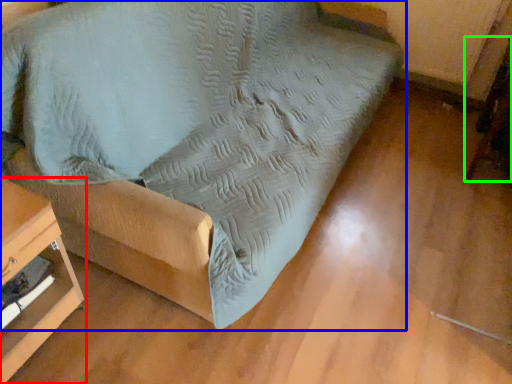
Question: Which object is positioned closest to furniture (highlighted by a red box)? Select from furniture (highlighted by a blue box) and swivel chair (highlighted by a green box).

Choices:
 (A) furniture
 (B) swivel chair

Answer: (A)